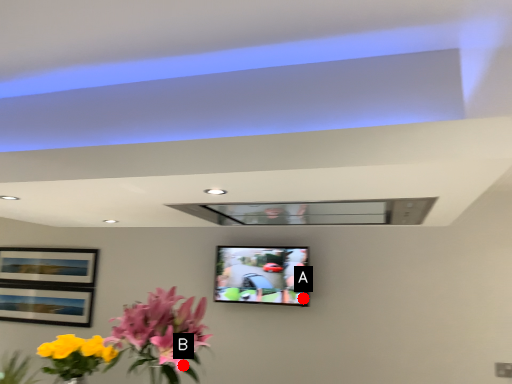
Question: Two points are circled on the image, labeled by A and B beside each circle. Which of the following is the closest to the observer?

Choices:
 (A) A is closer
 (B) B is closer

Answer: (B)